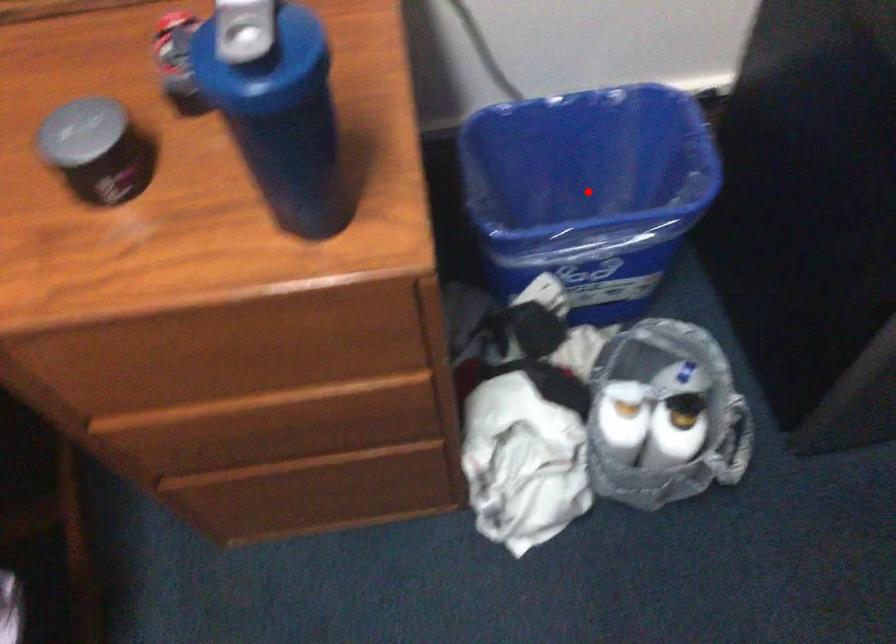
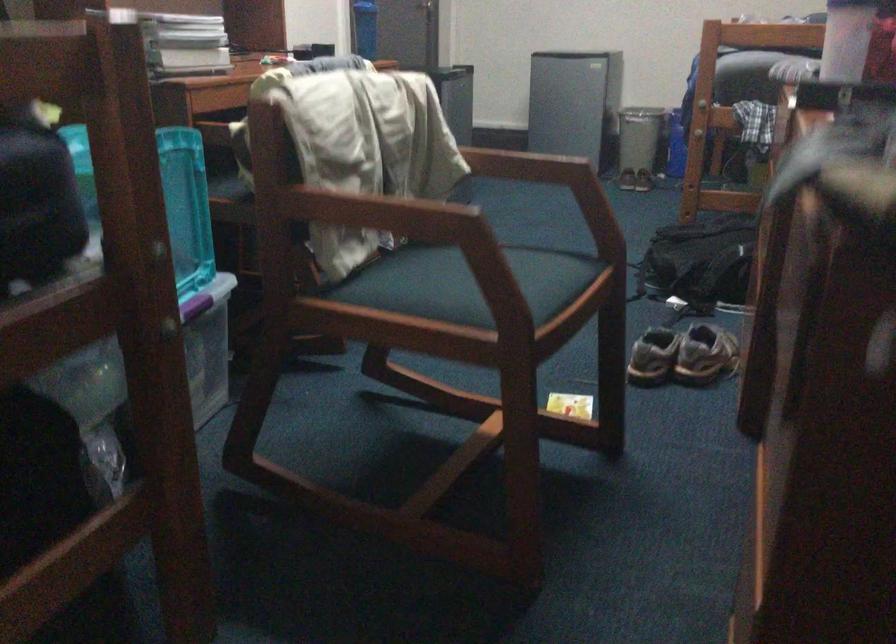
Question: I am providing you with two images of the same scene from different viewpoints. A red point is marked on the first image. Can you still see the location of the red point in image 2?

Choices:
 (A) Yes
 (B) No

Answer: (B)